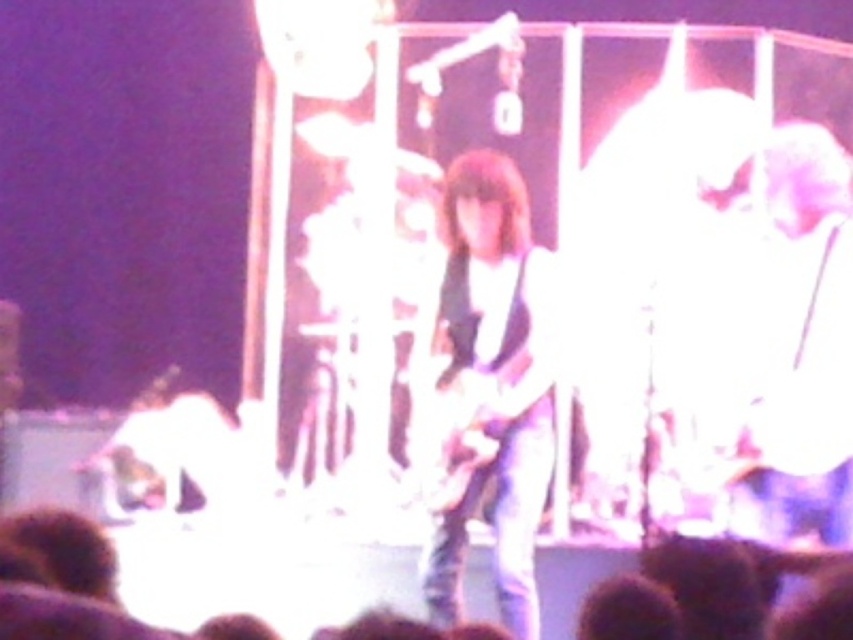
Question: Can you confirm if matte black guitar at center is positioned below shiny metallic guitar at center?

Choices:
 (A) yes
 (B) no

Answer: (B)

Question: Which object appears closest to the camera in this image?

Choices:
 (A) matte black guitar at center
 (B) shiny metallic guitar at center

Answer: (A)

Question: Does matte black guitar at center come in front of shiny metallic guitar at center?

Choices:
 (A) yes
 (B) no

Answer: (A)

Question: Which object is closer to the camera taking this photo?

Choices:
 (A) shiny metallic guitar at center
 (B) matte black guitar at center

Answer: (B)

Question: Does matte black guitar at center appear over shiny metallic guitar at center?

Choices:
 (A) yes
 (B) no

Answer: (A)